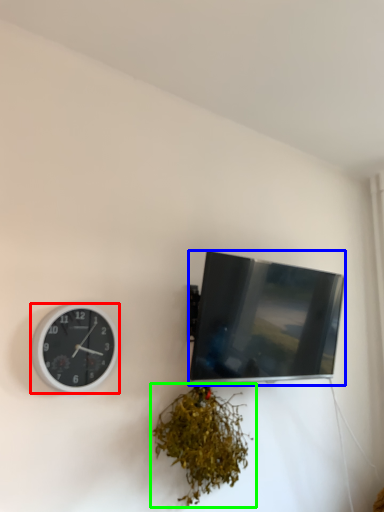
Question: Which object is positioned farthest from wall clock (highlighted by a red box)? Select from television (highlighted by a blue box) and houseplant (highlighted by a green box).

Choices:
 (A) television
 (B) houseplant

Answer: (A)